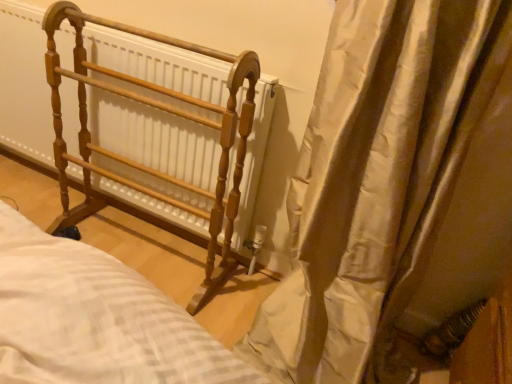
Question: Could you tell me if silky beige curtain at right is turned towards wooden rack at left?

Choices:
 (A) yes
 (B) no

Answer: (B)

Question: Does silky beige curtain at right lie in front of wooden rack at left?

Choices:
 (A) no
 (B) yes

Answer: (B)

Question: Is silky beige curtain at right bigger than wooden rack at left?

Choices:
 (A) yes
 (B) no

Answer: (A)

Question: From a real-world perspective, is silky beige curtain at right located beneath wooden rack at left?

Choices:
 (A) no
 (B) yes

Answer: (A)

Question: Is silky beige curtain at right not near wooden rack at left?

Choices:
 (A) no
 (B) yes

Answer: (A)

Question: Is silky beige curtain at right at the right side of wooden rack at left?

Choices:
 (A) no
 (B) yes

Answer: (B)

Question: Does wooden rack at left lie behind silky beige curtain at right?

Choices:
 (A) no
 (B) yes

Answer: (B)

Question: Would you say wooden rack at left contains silky beige curtain at right?

Choices:
 (A) no
 (B) yes

Answer: (A)

Question: Is wooden rack at left at the left side of silky beige curtain at right?

Choices:
 (A) yes
 (B) no

Answer: (A)

Question: Considering the relative sizes of wooden rack at left and silky beige curtain at right in the image provided, is wooden rack at left taller than silky beige curtain at right?

Choices:
 (A) yes
 (B) no

Answer: (B)

Question: Can you confirm if wooden rack at left is shorter than silky beige curtain at right?

Choices:
 (A) yes
 (B) no

Answer: (A)

Question: Can you confirm if wooden rack at left is smaller than silky beige curtain at right?

Choices:
 (A) no
 (B) yes

Answer: (B)

Question: Looking at the image, does wooden rack at left seem bigger or smaller compared to silky beige curtain at right?

Choices:
 (A) big
 (B) small

Answer: (B)